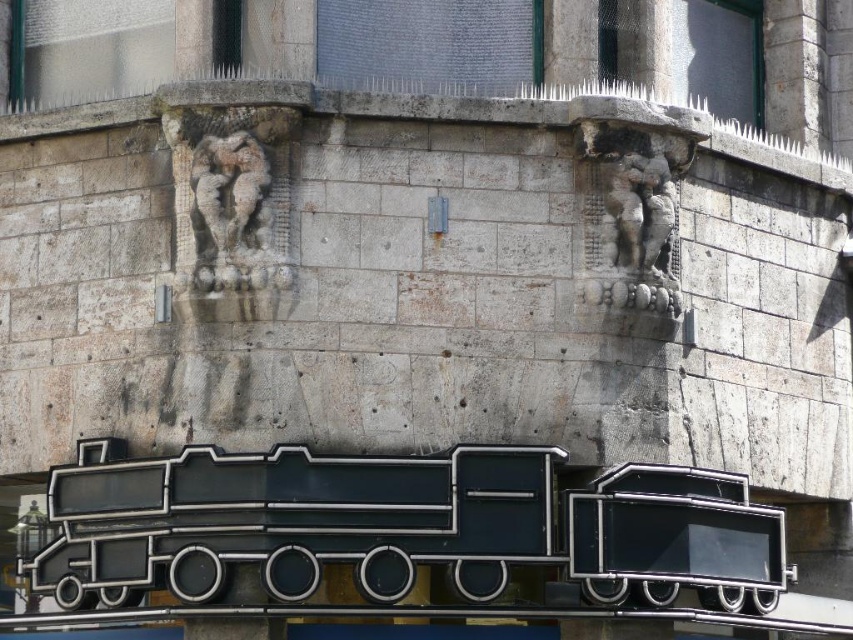
Question: Which object is closer to the camera taking this photo?

Choices:
 (A) carved stone cherub at upper center
 (B) rustic stone cherubim at upper right

Answer: (A)

Question: Does rustic stone cherubim at upper right appear on the left side of carved stone cherub at upper center?

Choices:
 (A) yes
 (B) no

Answer: (B)

Question: Which point appears closest to the camera in this image?

Choices:
 (A) (656, 266)
 (B) (241, 180)

Answer: (B)

Question: Does rustic stone cherubim at upper right have a larger size compared to carved stone cherub at upper center?

Choices:
 (A) no
 (B) yes

Answer: (B)

Question: Where is rustic stone cherubim at upper right located in relation to carved stone cherub at upper center in the image?

Choices:
 (A) above
 (B) below

Answer: (B)